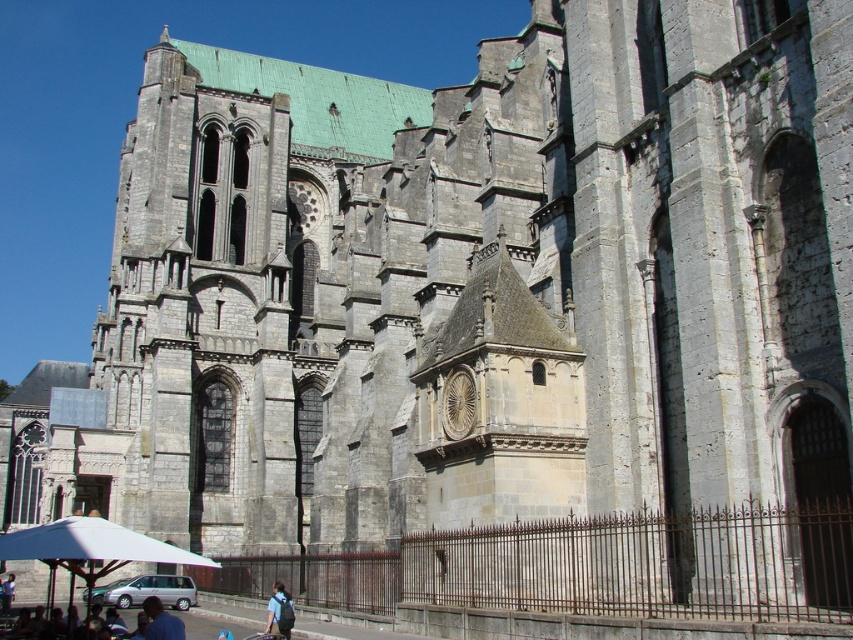
Question: Is dark blue shirt at lower center smaller than blue fabric backpack at lower center?

Choices:
 (A) no
 (B) yes

Answer: (A)

Question: Considering the relative positions of dark blue shirt at lower center and blue fabric backpack at lower center in the image provided, where is dark blue shirt at lower center located with respect to blue fabric backpack at lower center?

Choices:
 (A) left
 (B) right

Answer: (A)

Question: Which point is closer to the camera taking this photo?

Choices:
 (A) (158, 637)
 (B) (276, 616)

Answer: (A)

Question: Which point is closer to the camera taking this photo?

Choices:
 (A) (276, 605)
 (B) (152, 596)

Answer: (A)

Question: Does dark blue shirt at lower center have a greater width compared to blue fabric backpack at lower center?

Choices:
 (A) yes
 (B) no

Answer: (A)